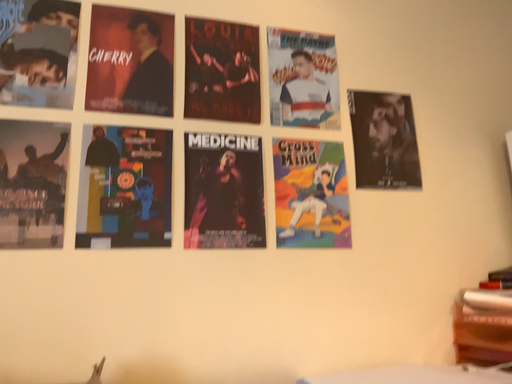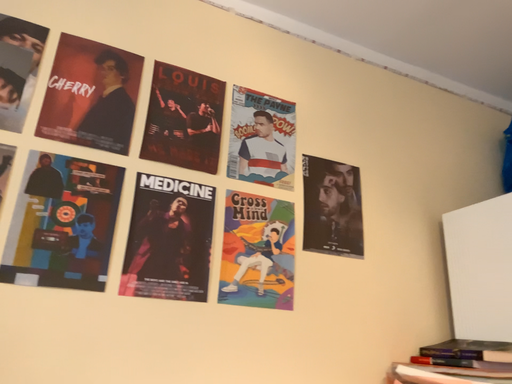
Question: Which way did the camera rotate in the video?

Choices:
 (A) rotated right
 (B) rotated left

Answer: (A)